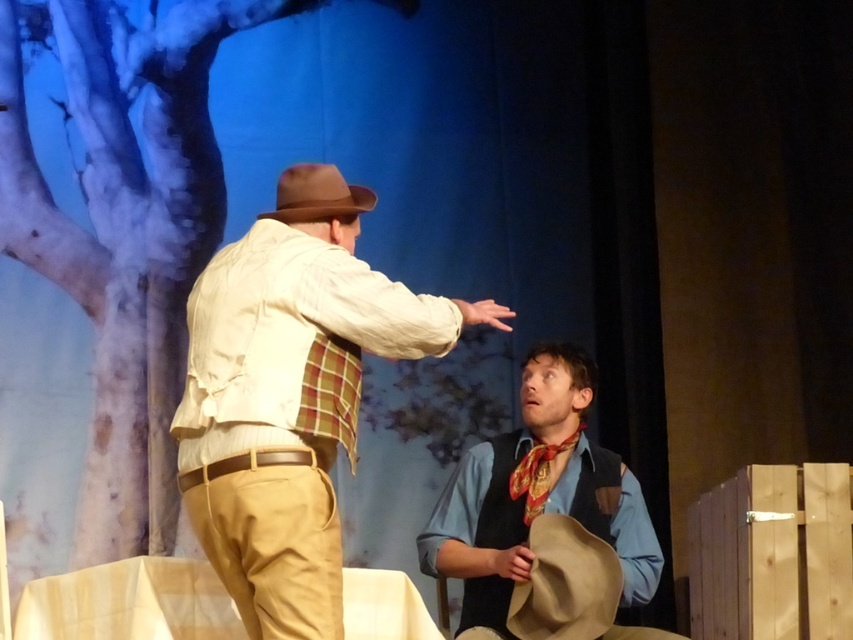
You are an actor in the play and need to retrieve an item from the stage. You see the brown felt cowboy hat at lower center and the red silk necktie at center. Which item is physically nearer to you as you stand on the stage?

The brown felt cowboy hat at lower center is closer to the viewer than the red silk necktie at center, so the cowboy hat is nearer.

You are an actor in a play and need to choose a costume piece that is larger than the other. Which one should you pick between the blue denim shirt at center and the brown felt cowboy hat at upper center?

The blue denim shirt at center is bigger than the brown felt cowboy hat at upper center, so you should pick the blue denim shirt at center.

You are an actor in a play and need to adjust your costume. You have the brown felt cowboy hat at lower center and the red silk necktie at center. Which item is located below the other?

The brown felt cowboy hat at lower center is positioned under the red silk necktie at center.